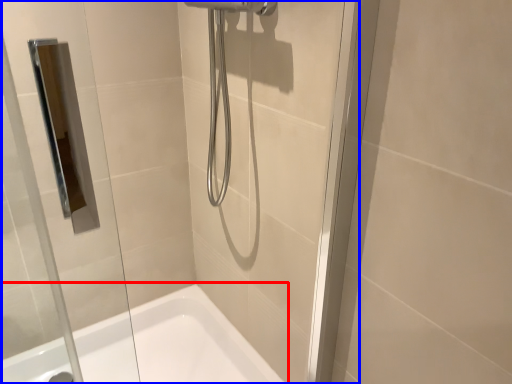
Question: Which point is closer to the camera, bathtub (highlighted by a red box) or glass door (highlighted by a blue box)?

Choices:
 (A) bathtub
 (B) glass door

Answer: (B)